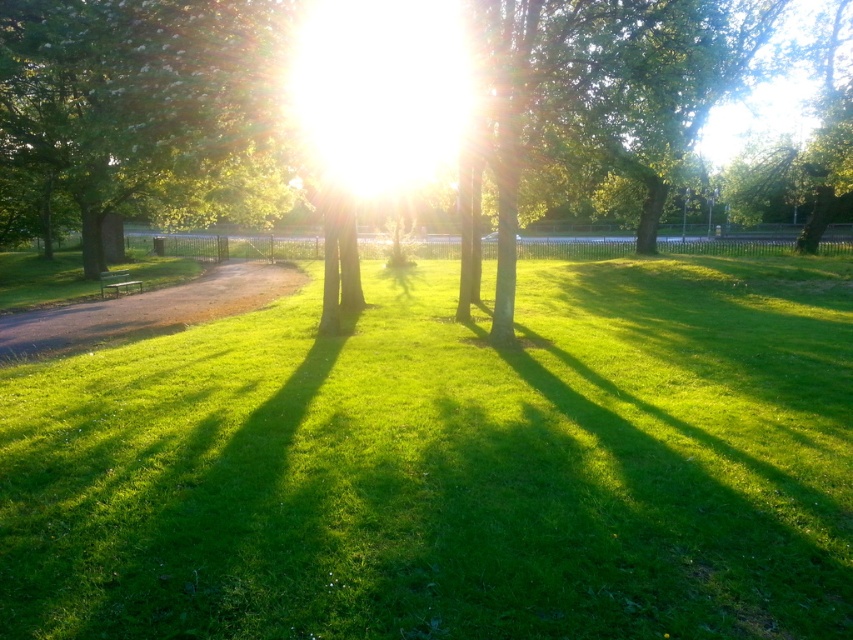
Question: Does green grassy at center appear on the right side of green leafy tree at center?

Choices:
 (A) no
 (B) yes

Answer: (B)

Question: Can you confirm if green leafy tree at center is positioned to the right of green metal bench at lower left?

Choices:
 (A) yes
 (B) no

Answer: (A)

Question: Is green grassy at center above green leafy tree at center?

Choices:
 (A) no
 (B) yes

Answer: (A)

Question: Which of the following is the farthest from the observer?

Choices:
 (A) (55, 32)
 (B) (233, 125)

Answer: (A)

Question: Estimate the real-world distances between objects in this image. Which object is farther from the green leafy tree at center?

Choices:
 (A) green metal bench at lower left
 (B) green grassy at center

Answer: (A)

Question: Which is farther from the brown gravel path at left?

Choices:
 (A) green leafy tree at center
 (B) green metal bench at lower left
 (C) green grassy at center

Answer: (C)